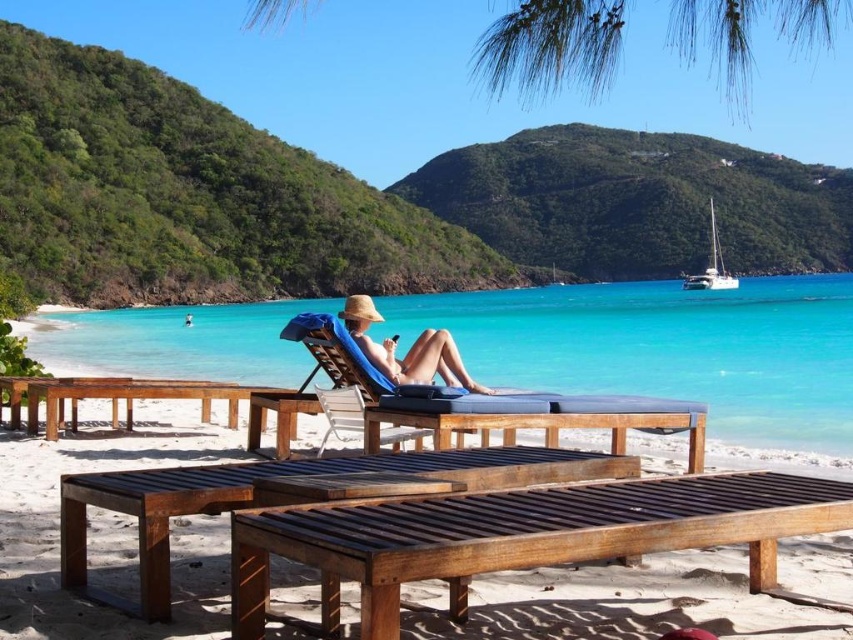
Question: Does brown wooden lounge chair at center come behind clear blue water at center?

Choices:
 (A) no
 (B) yes

Answer: (A)

Question: Does blue fabric beach chair at center have a smaller size compared to matte straw hat at center?

Choices:
 (A) no
 (B) yes

Answer: (A)

Question: Does brown wooden lounge chair at center appear on the left side of blue fabric beach chair at center?

Choices:
 (A) yes
 (B) no

Answer: (A)

Question: Which point is closer to the camera?

Choices:
 (A) brown wooden lounge chair at center
 (B) brown wooden bench at center
 (C) brown wooden picnic table at center
 (D) matte straw hat at center

Answer: (B)

Question: Which of the following is the closest to the observer?

Choices:
 (A) brown wooden bench at center
 (B) brown wooden lounge chair at center
 (C) blue fabric beach chair at center
 (D) clear blue water at center

Answer: (A)

Question: Among these objects, which one is farthest from the camera?

Choices:
 (A) clear blue water at center
 (B) blue fabric beach chair at center
 (C) brown wooden lounge chair at center

Answer: (A)